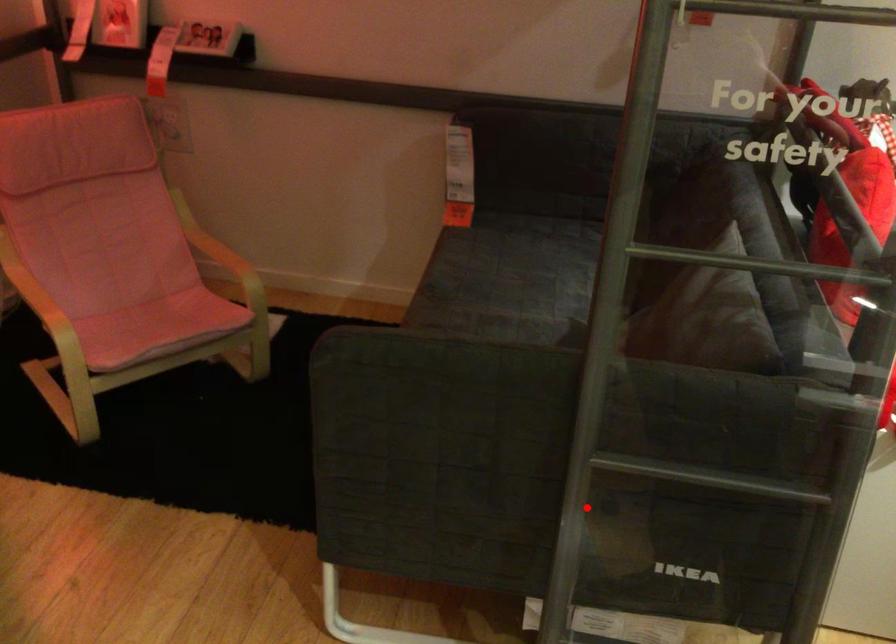
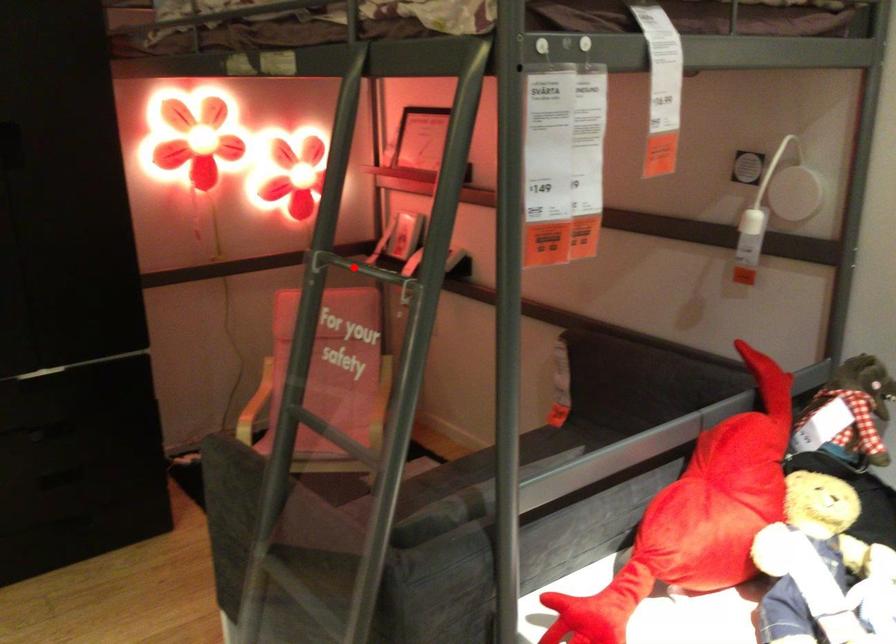
I am providing you with two images of the same scene from different viewpoints. A red point is marked on the first image and another point is marked on the second image. Is the marked point in image1 the same physical position as the marked point in image2?

No